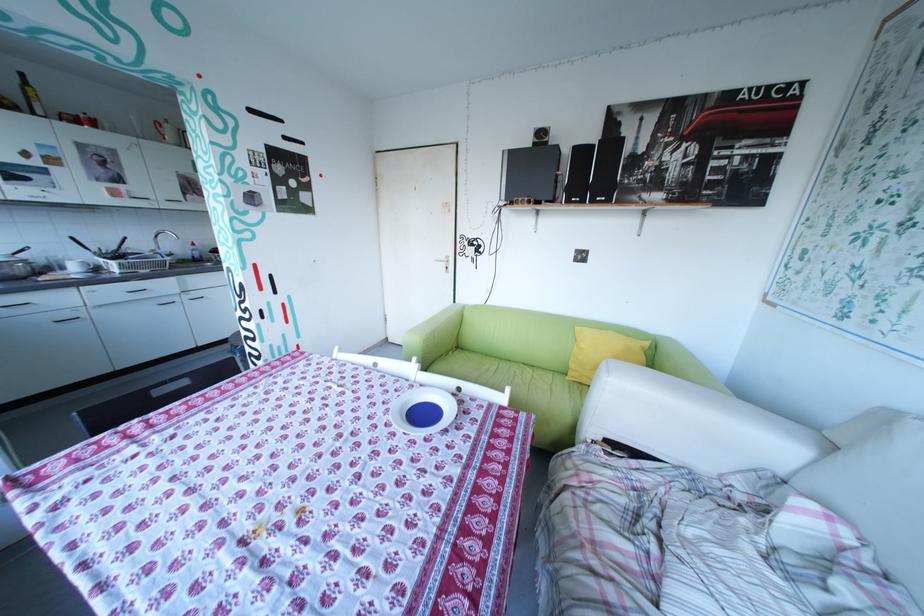
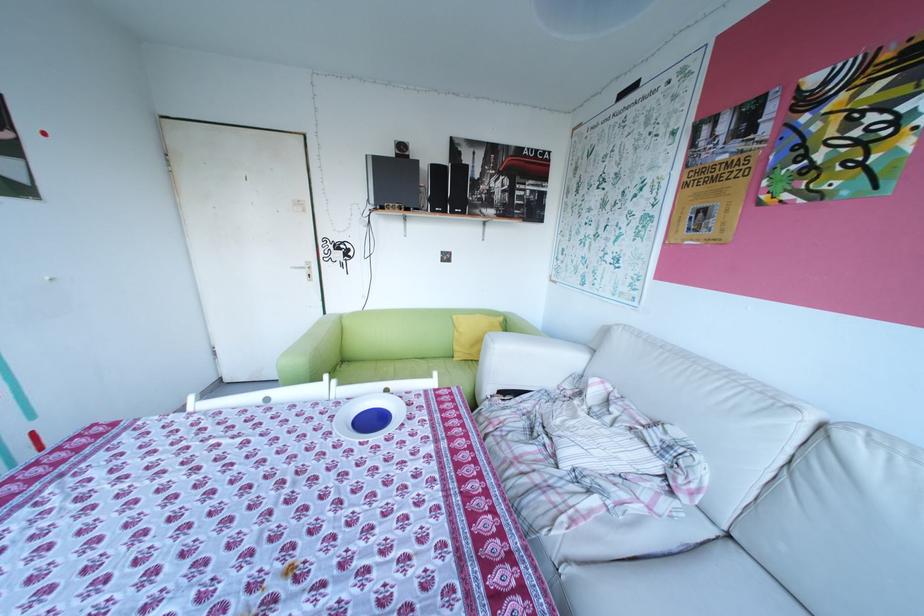
The point at (580, 201) is marked in the first image. Where is the corresponding point in the second image?

(445, 209)